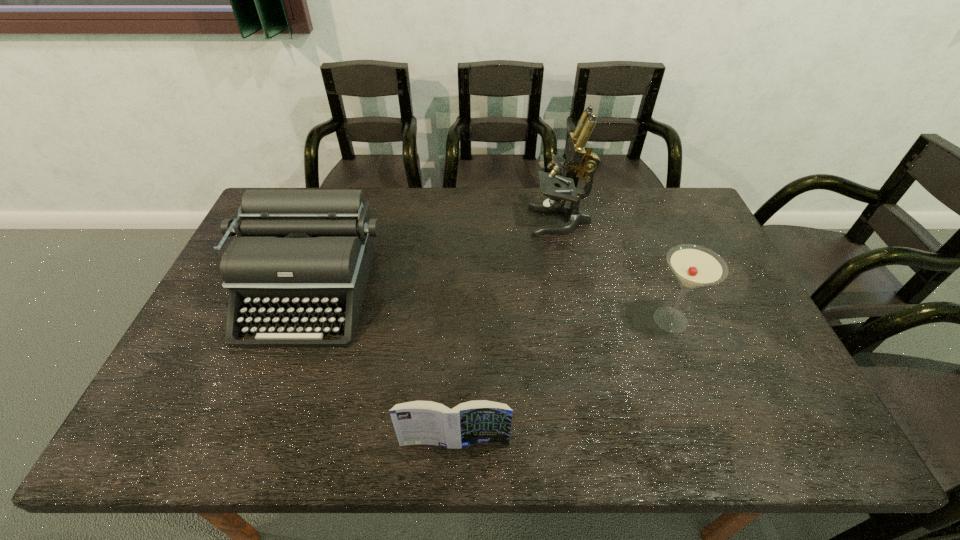
The height and width of the screenshot is (540, 960). I want to click on vacant space in between the typewriter and the rightmost object, so click(490, 306).

Image resolution: width=960 pixels, height=540 pixels. In order to click on free space between the book and the microscope in this screenshot , I will do `click(507, 332)`.

Locate an element on the screen. Image resolution: width=960 pixels, height=540 pixels. empty location between the microscope and the third object from right to left is located at coordinates (507, 332).

Image resolution: width=960 pixels, height=540 pixels. Identify the location of empty space that is in between the third object from right to left and the typewriter. (381, 368).

What are the coordinates of `free area in between the third object from right to left and the leftmost object` in the screenshot? It's located at (381, 368).

Where is `vacant space that's between the martini and the microscope`? The height and width of the screenshot is (540, 960). vacant space that's between the martini and the microscope is located at coordinates (615, 271).

The height and width of the screenshot is (540, 960). Identify the location of blank region between the typewriter and the farthest object. (434, 257).

The image size is (960, 540). I want to click on vacant space that's between the book and the typewriter, so click(x=381, y=368).

At what (x,y) coordinates should I click in order to perform the action: click on free space between the leftmost object and the martini. Please return your answer as a coordinate pair (x, y). The width and height of the screenshot is (960, 540). Looking at the image, I should click on (490, 306).

Locate an element on the screen. object that is the closest to the rightmost object is located at coordinates (579, 153).